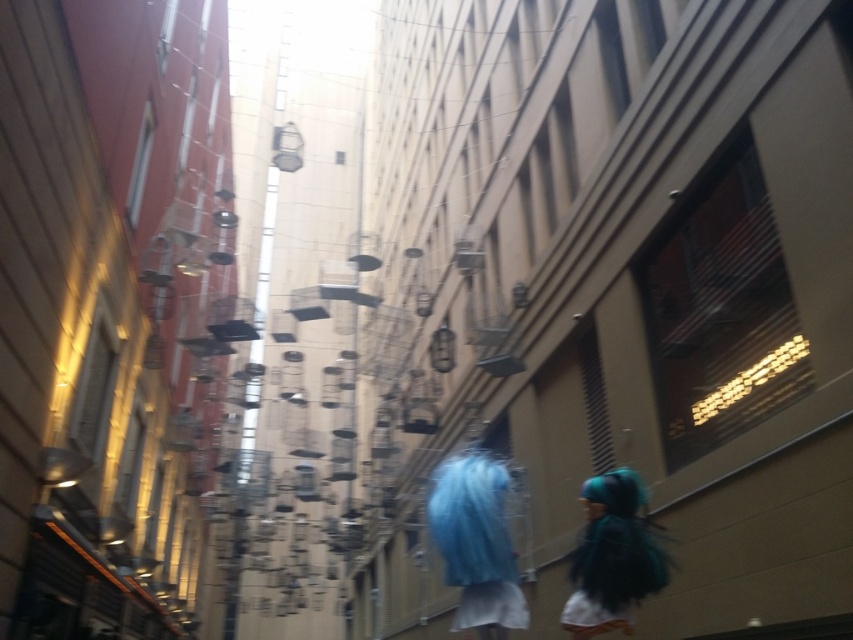
Question: Is blue fuzzy wig at center to the left of teal matte wig at lower right from the viewer's perspective?

Choices:
 (A) yes
 (B) no

Answer: (A)

Question: Does blue fuzzy wig at center appear under teal matte wig at lower right?

Choices:
 (A) yes
 (B) no

Answer: (B)

Question: Among these points, which one is nearest to the camera?

Choices:
 (A) (498, 538)
 (B) (619, 547)

Answer: (A)

Question: Which point is farther from the camera taking this photo?

Choices:
 (A) (616, 531)
 (B) (495, 589)

Answer: (A)

Question: Can you confirm if blue fuzzy wig at center is positioned below teal matte wig at lower right?

Choices:
 (A) no
 (B) yes

Answer: (A)